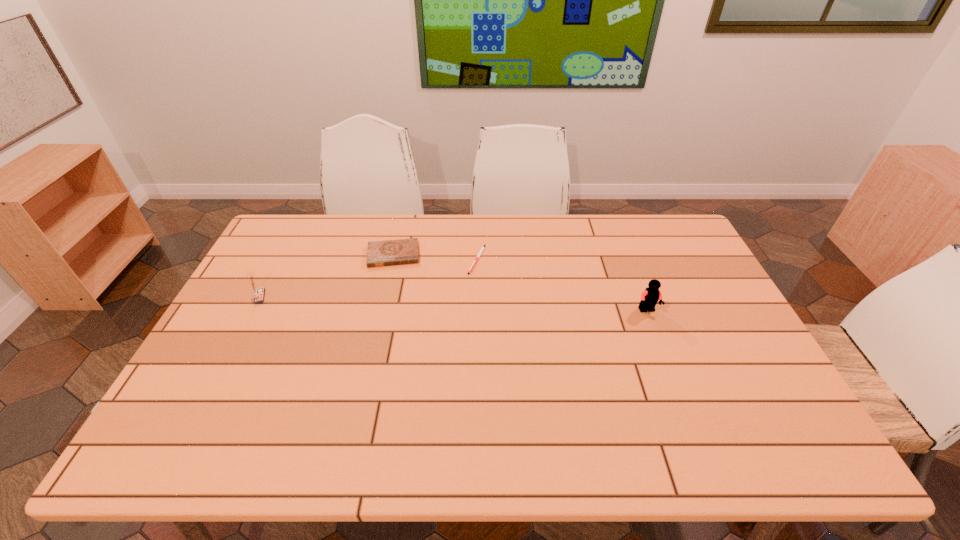
At what (x,y) coordinates should I click in order to perform the action: click on vacant space located 0.350m on the clicker of the pen. Please return your answer as a coordinate pair (x, y). The image size is (960, 540). Looking at the image, I should click on (504, 362).

Where is `vacant position located 0.110m on the clicker of the pen`? This screenshot has height=540, width=960. vacant position located 0.110m on the clicker of the pen is located at coordinates (486, 299).

Find the location of a particular element. free space located 0.310m on the clicker of the pen is located at coordinates (501, 350).

Identify the location of free space located on the spine side of the second shortest object. (394, 302).

Find the location of a particular element. The height and width of the screenshot is (540, 960). vacant space located 0.260m on the spine side of the second shortest object is located at coordinates (394, 327).

At what (x,y) coordinates should I click in order to perform the action: click on blank space located 0.190m on the spine side of the second shortest object. Please return your answer as a coordinate pair (x, y). The width and height of the screenshot is (960, 540). Looking at the image, I should click on (394, 310).

This screenshot has width=960, height=540. I want to click on pen located at the far edge, so click(479, 254).

In order to click on diary that is at the far edge in this screenshot , I will do `click(402, 251)`.

This screenshot has width=960, height=540. What are the coordinates of `object that is at the left edge` in the screenshot? It's located at (258, 293).

Find the location of a particular element. This screenshot has height=540, width=960. vacant space at the far edge of the desktop is located at coordinates (559, 251).